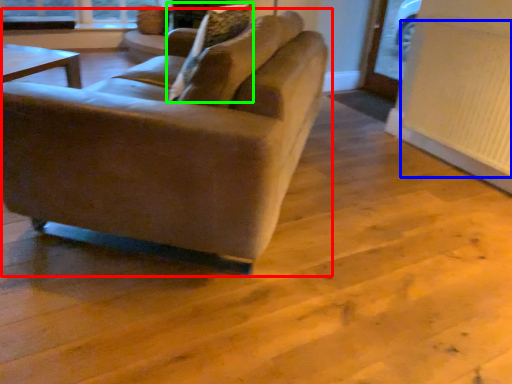
Question: Based on their relative distances, which object is farther from studio couch (highlighted by a red box)? Choose from radiator (highlighted by a blue box) and pillow (highlighted by a green box).

Choices:
 (A) radiator
 (B) pillow

Answer: (A)